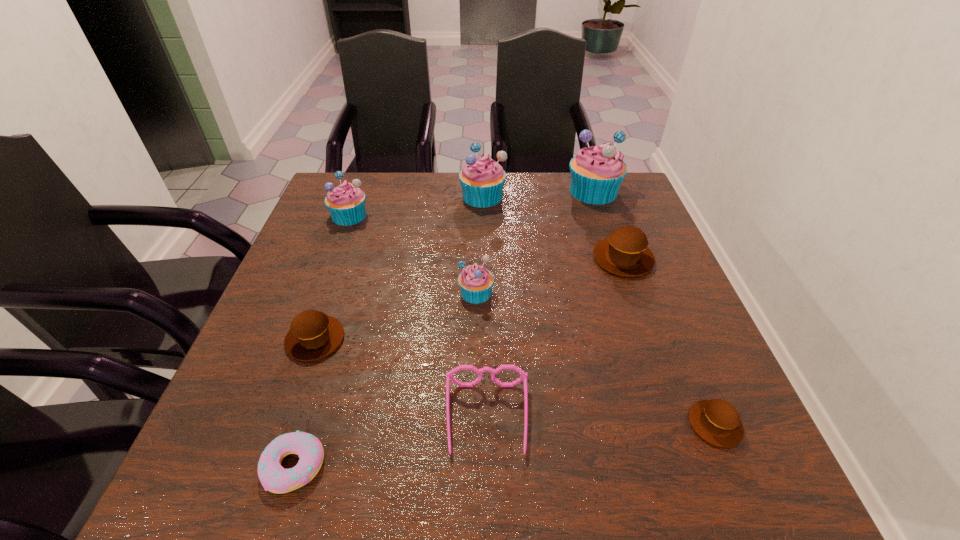
The image size is (960, 540). Identify the location of free space between the eighth shortest object and the leftmost blue muffin. (416, 206).

Find the location of a particular element. free space between the rightmost blue muffin and the spectacles is located at coordinates (540, 305).

Where is `blank region between the second tallest muffin and the biggest blue muffin`? This screenshot has width=960, height=540. blank region between the second tallest muffin and the biggest blue muffin is located at coordinates (538, 194).

In order to click on free area in between the nearest muffin and the doughnut in this screenshot , I will do `click(505, 445)`.

Find the location of `vacant space that is in between the tallest muffin and the second biggest blue muffin`. vacant space that is in between the tallest muffin and the second biggest blue muffin is located at coordinates (538, 194).

I want to click on vacant point located between the nearest blue muffin and the second nearest brown muffin, so click(x=396, y=316).

Identify the location of the fourth closest object to the second tallest object. (475, 281).

Locate which object is the second closest to the eighth tallest object. Please provide its 2D coordinates. Your answer should be formatted as a tuple, i.e. [(x, y)], where the tuple contains the x and y coordinates of a point satisfying the conditions above.

[(625, 252)]

Where is `muffin identified as the second closest to the nearest muffin`? The height and width of the screenshot is (540, 960). muffin identified as the second closest to the nearest muffin is located at coordinates (475, 281).

Identify the location of muffin object that ranks as the fourth closest to the spectacles. Image resolution: width=960 pixels, height=540 pixels. (625, 252).